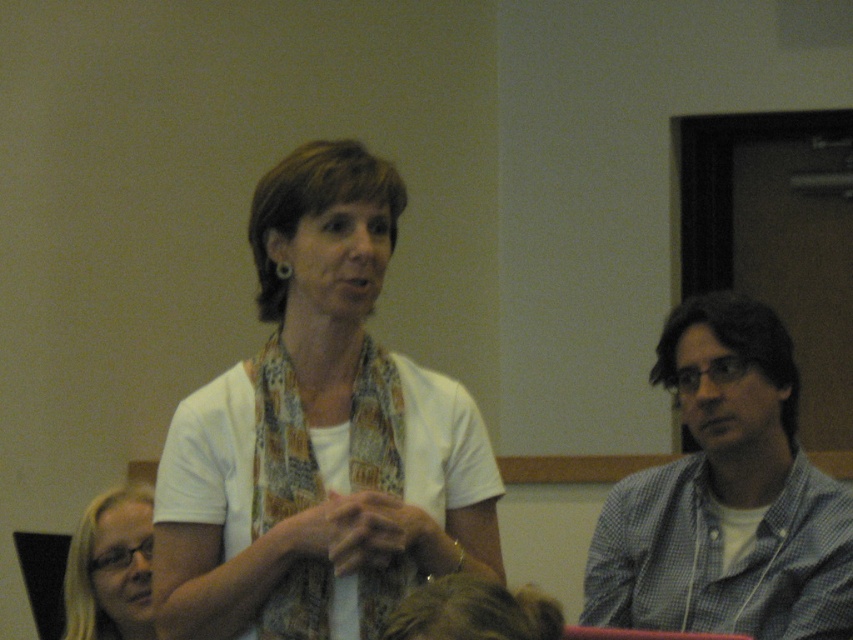
Question: Does white matte scarf at center appear under checkered fabric shirt at right?

Choices:
 (A) no
 (B) yes

Answer: (A)

Question: Estimate the real-world distances between objects in this image. Which object is closer to the checkered fabric shirt at right?

Choices:
 (A) matte black glasses at lower left
 (B) white matte scarf at center

Answer: (B)

Question: Which point is farther to the camera?

Choices:
 (A) white matte scarf at center
 (B) checkered fabric shirt at right

Answer: (B)

Question: Which point is farther from the camera taking this photo?

Choices:
 (A) (126, 541)
 (B) (770, 401)
 (C) (329, 365)

Answer: (A)

Question: Can you confirm if checkered fabric shirt at right is positioned above matte black glasses at lower left?

Choices:
 (A) no
 (B) yes

Answer: (B)

Question: Is white matte scarf at center thinner than matte black glasses at lower left?

Choices:
 (A) no
 (B) yes

Answer: (A)